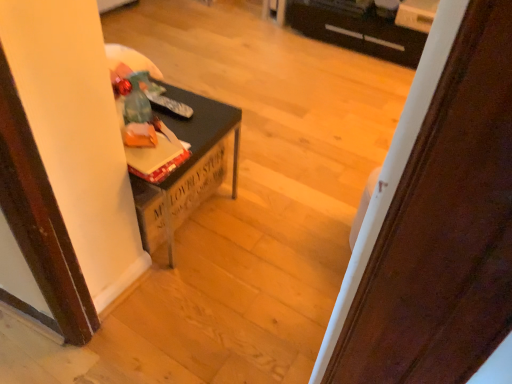
This screenshot has width=512, height=384. In order to click on free location in front of black plastic drawer at upper center in this screenshot , I will do `click(351, 81)`.